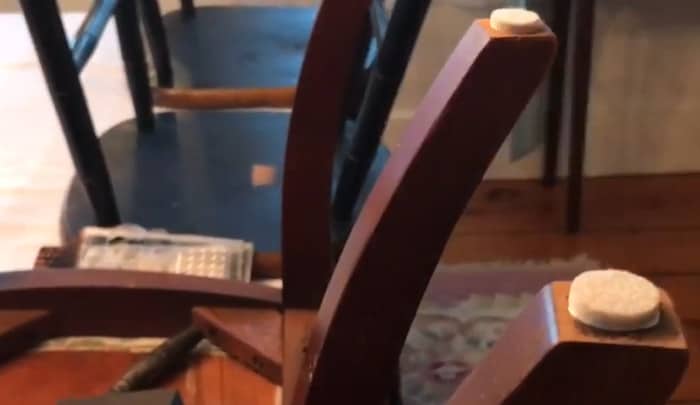
Where is `floor`? The image size is (700, 405). floor is located at coordinates coord(643,236).